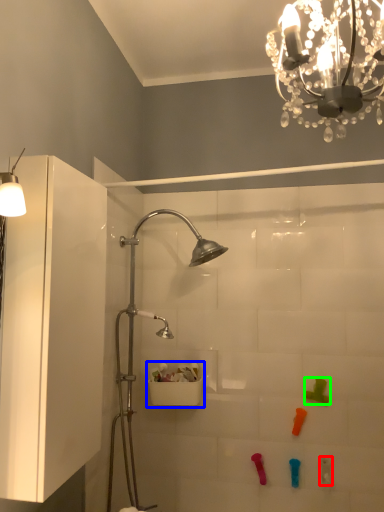
Question: Estimate the real-world distances between objects in this image. Which object is farther from toy (highlighted by a red box), sink (highlighted by a blue box) or toy (highlighted by a green box)?

Choices:
 (A) sink
 (B) toy

Answer: (A)